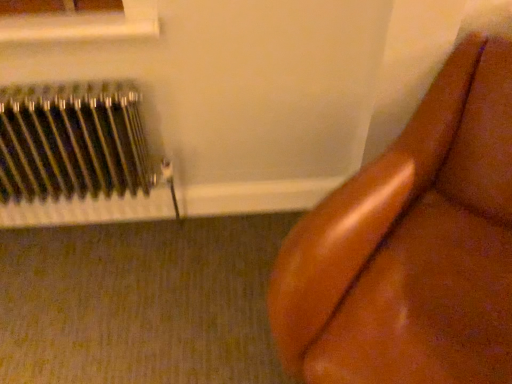
Question: Considering their positions, is white plastic window frame at upper left located in front of or behind brown leather couch at right?

Choices:
 (A) front
 (B) behind

Answer: (B)

Question: In terms of width, does white plastic window frame at upper left look wider or thinner when compared to brown leather couch at right?

Choices:
 (A) thin
 (B) wide

Answer: (A)

Question: Which is nearer to the metallic silver radiator at left?

Choices:
 (A) brown leather couch at right
 (B) white plastic window frame at upper left

Answer: (B)

Question: Which is farther from the metallic silver radiator at left?

Choices:
 (A) white plastic window frame at upper left
 (B) brown leather couch at right

Answer: (B)